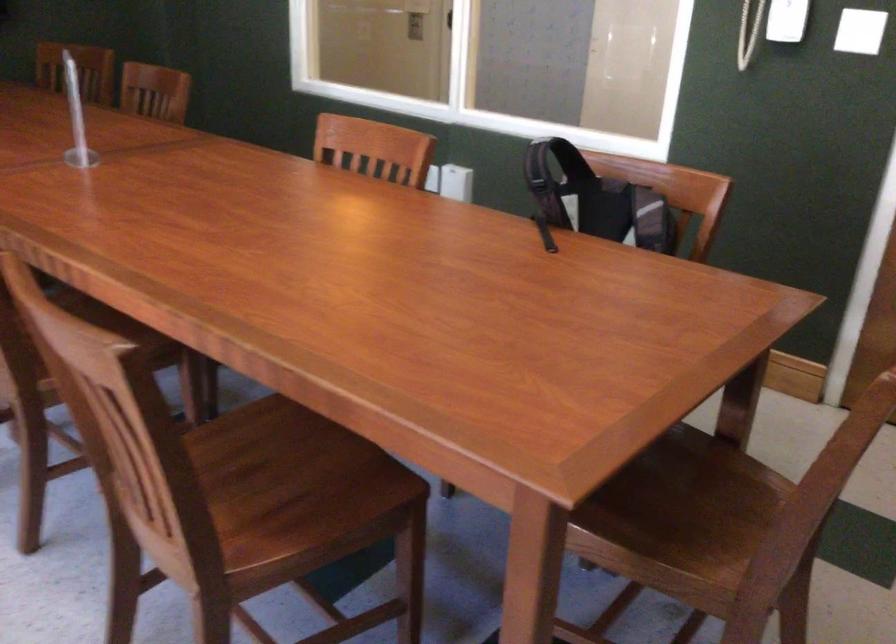
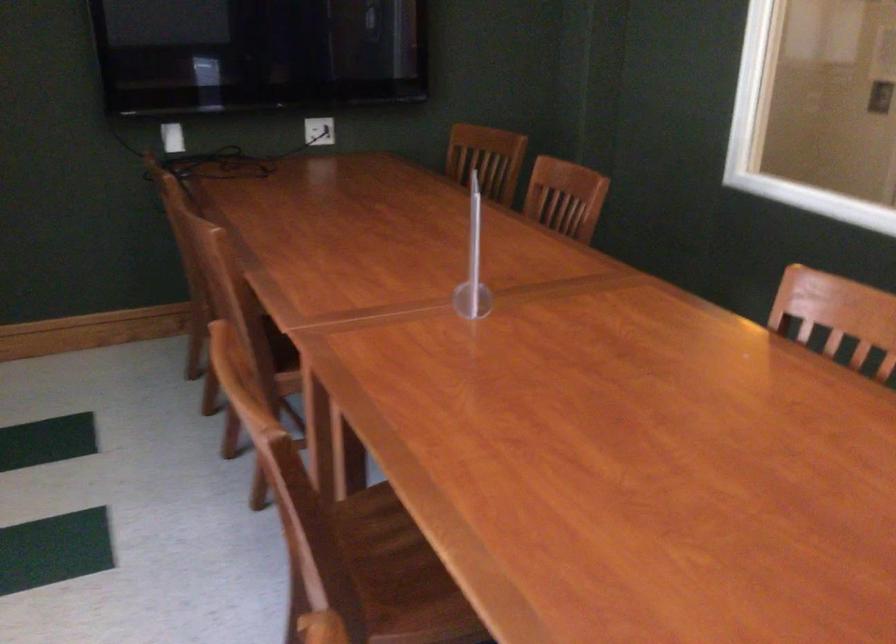
Find the pixel in the second image that matches [74,71] in the first image.

(487, 158)